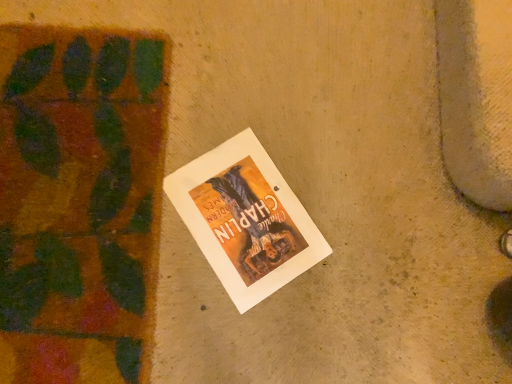
Question: Is green leafy plant at left further to the viewer compared to white paper poster at center?

Choices:
 (A) yes
 (B) no

Answer: (B)

Question: Is green leafy plant at left outside of white paper poster at center?

Choices:
 (A) yes
 (B) no

Answer: (A)

Question: Does green leafy plant at left lie in front of white paper poster at center?

Choices:
 (A) yes
 (B) no

Answer: (A)

Question: Can you confirm if green leafy plant at left is wider than white paper poster at center?

Choices:
 (A) yes
 (B) no

Answer: (A)

Question: Is green leafy plant at left oriented towards white paper poster at center?

Choices:
 (A) yes
 (B) no

Answer: (B)

Question: Can you confirm if green leafy plant at left is positioned to the right of white paper poster at center?

Choices:
 (A) no
 (B) yes

Answer: (A)

Question: Is white paper poster at center to the left of green leafy plant at left from the viewer's perspective?

Choices:
 (A) no
 (B) yes

Answer: (A)

Question: From a real-world perspective, is white paper poster at center physically below green leafy plant at left?

Choices:
 (A) yes
 (B) no

Answer: (A)

Question: Considering the relative sizes of white paper poster at center and green leafy plant at left in the image provided, is white paper poster at center thinner than green leafy plant at left?

Choices:
 (A) no
 (B) yes

Answer: (B)

Question: From a real-world perspective, is white paper poster at center on top of green leafy plant at left?

Choices:
 (A) no
 (B) yes

Answer: (A)

Question: Considering the relative positions of white paper poster at center and green leafy plant at left in the image provided, is white paper poster at center in front of green leafy plant at left?

Choices:
 (A) no
 (B) yes

Answer: (A)

Question: Considering the relative positions of white paper poster at center and green leafy plant at left in the image provided, is white paper poster at center to the right of green leafy plant at left from the viewer's perspective?

Choices:
 (A) no
 (B) yes

Answer: (B)

Question: From their relative heights in the image, would you say white paper poster at center is taller or shorter than green leafy plant at left?

Choices:
 (A) short
 (B) tall

Answer: (B)